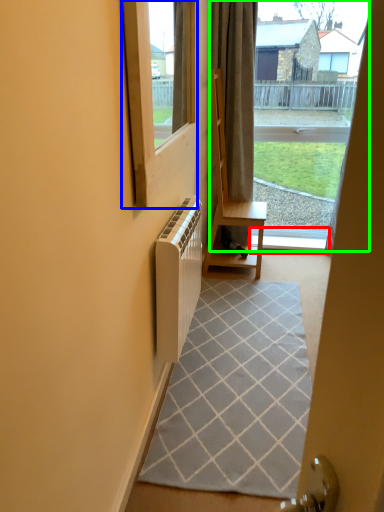
Question: Which object is positioned farthest from window sill (highlighted by a red box)? Select from window (highlighted by a blue box) and bay window (highlighted by a green box).

Choices:
 (A) window
 (B) bay window

Answer: (A)